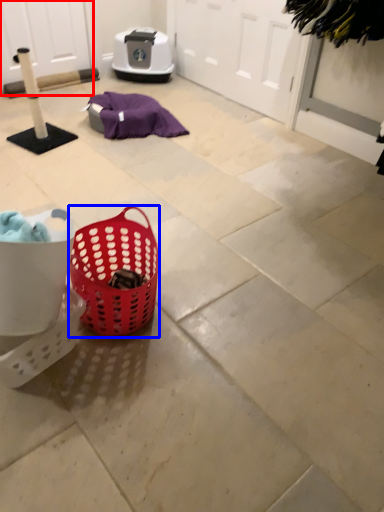
Question: Which object is closer to the camera taking this photo, screen door (highlighted by a red box) or picnic basket (highlighted by a blue box)?

Choices:
 (A) screen door
 (B) picnic basket

Answer: (B)